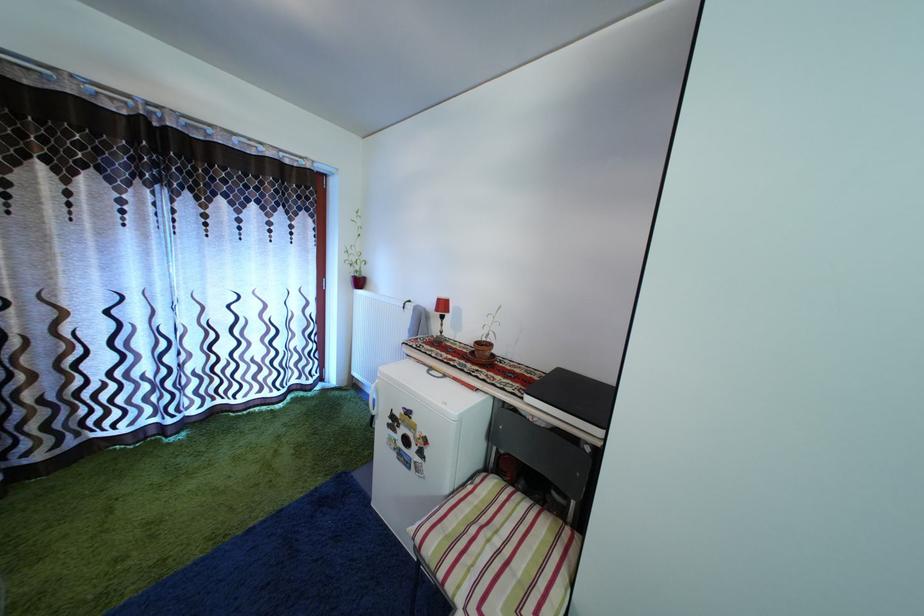
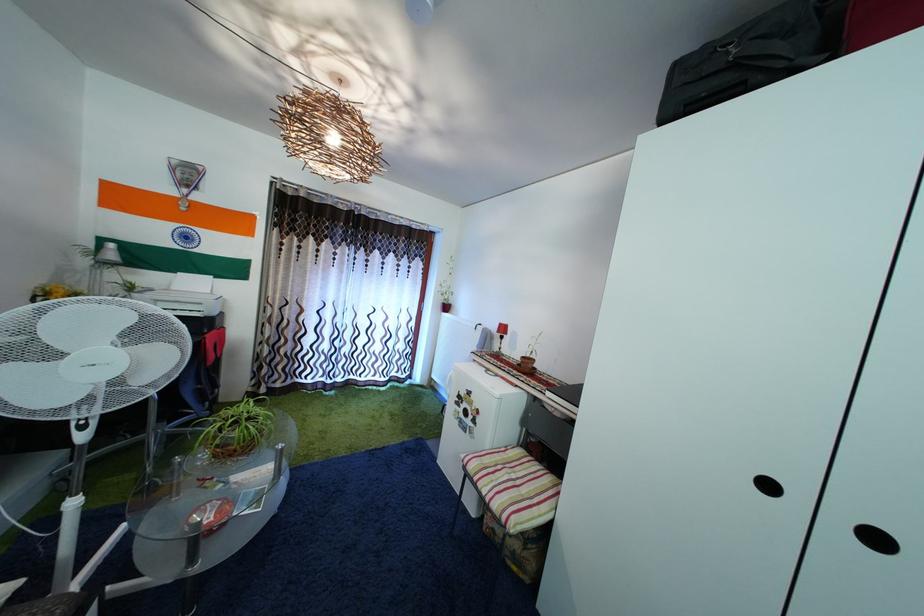
The point at [227,408] is marked in the first image. Where is the corresponding point in the second image?

(359, 384)